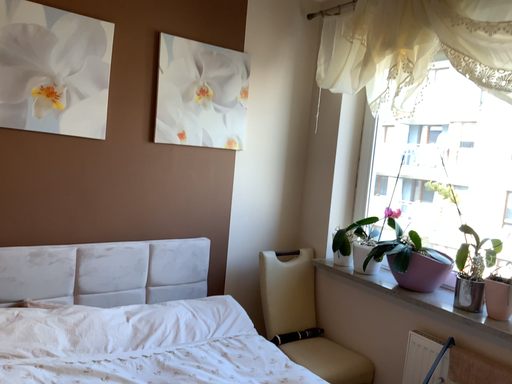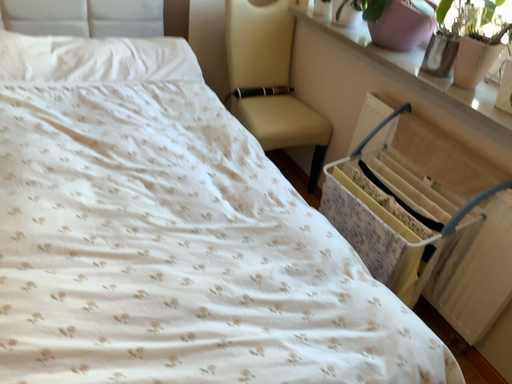
Question: How did the camera likely rotate when shooting the video?

Choices:
 (A) rotated upward
 (B) rotated downward

Answer: (B)